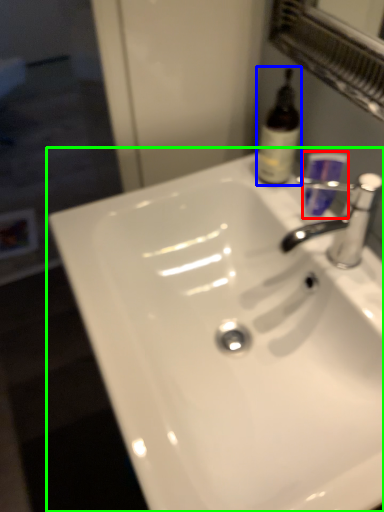
Question: Which object is positioned closest to mouthwash (highlighted by a red box)? Select from bottle (highlighted by a blue box) and sink (highlighted by a green box).

Choices:
 (A) bottle
 (B) sink

Answer: (A)